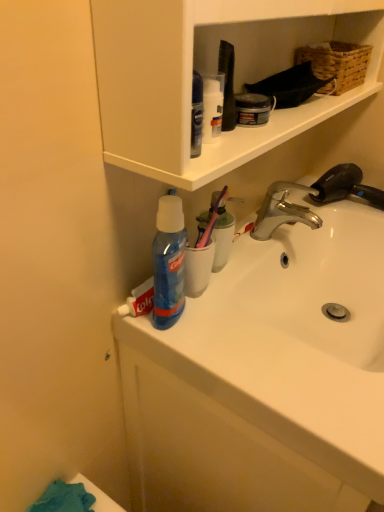
Question: Considering the relative sizes of woven brown basket at upper right and white glossy sink at center, the 2th sink from the bottom, in the image provided, is woven brown basket at upper right shorter than white glossy sink at center, the 2th sink from the bottom,?

Choices:
 (A) yes
 (B) no

Answer: (A)

Question: Is woven brown basket at upper right facing away from white glossy sink at center, placed as the 1th sink when sorted from top to bottom?

Choices:
 (A) no
 (B) yes

Answer: (A)

Question: Can you confirm if woven brown basket at upper right is smaller than white glossy sink at center, the 2th sink from the bottom?

Choices:
 (A) yes
 (B) no

Answer: (A)

Question: From a real-world perspective, is woven brown basket at upper right on white glossy sink at center, placed as the 1th sink when sorted from top to bottom?

Choices:
 (A) no
 (B) yes

Answer: (B)

Question: Is there a large distance between woven brown basket at upper right and white glossy sink at center, placed as the 1th sink when sorted from top to bottom?

Choices:
 (A) no
 (B) yes

Answer: (A)

Question: Relative to white glossy sink at center, the 2th sink from the bottom, is woven brown basket at upper right in front or behind?

Choices:
 (A) front
 (B) behind

Answer: (B)

Question: From a real-world perspective, relative to white glossy sink at center, placed as the 1th sink when sorted from top to bottom, is woven brown basket at upper right vertically above or below?

Choices:
 (A) above
 (B) below

Answer: (A)

Question: Do you think woven brown basket at upper right is within white glossy sink at center, placed as the 1th sink when sorted from top to bottom, or outside of it?

Choices:
 (A) outside
 (B) inside

Answer: (A)

Question: Considering the positions of woven brown basket at upper right and white glossy sink at center, placed as the 1th sink when sorted from top to bottom, in the image, is woven brown basket at upper right wider or thinner than white glossy sink at center, placed as the 1th sink when sorted from top to bottom,?

Choices:
 (A) thin
 (B) wide

Answer: (A)

Question: From the image's perspective, is white glossy sink at center, placed as the 1th sink when sorted from top to bottom, positioned above or below woven brown basket at upper right?

Choices:
 (A) above
 (B) below

Answer: (B)

Question: Is white glossy sink at center, placed as the 1th sink when sorted from top to bottom, situated inside woven brown basket at upper right or outside?

Choices:
 (A) inside
 (B) outside

Answer: (B)

Question: Considering the positions of white glossy sink at center, placed as the 1th sink when sorted from top to bottom, and woven brown basket at upper right in the image, is white glossy sink at center, placed as the 1th sink when sorted from top to bottom, taller or shorter than woven brown basket at upper right?

Choices:
 (A) short
 (B) tall

Answer: (B)

Question: In the image, is white glossy sink at center, placed as the 1th sink when sorted from top to bottom, positioned in front of or behind woven brown basket at upper right?

Choices:
 (A) front
 (B) behind

Answer: (A)

Question: Which is correct: white glossy sink at center, placed as the 1th sink when sorted from top to bottom, is inside silver metallic faucet at upper right, or outside of it?

Choices:
 (A) outside
 (B) inside

Answer: (A)

Question: From the image's perspective, is white glossy sink at center, the 2th sink from the bottom, located above or below silver metallic faucet at upper right?

Choices:
 (A) above
 (B) below

Answer: (B)